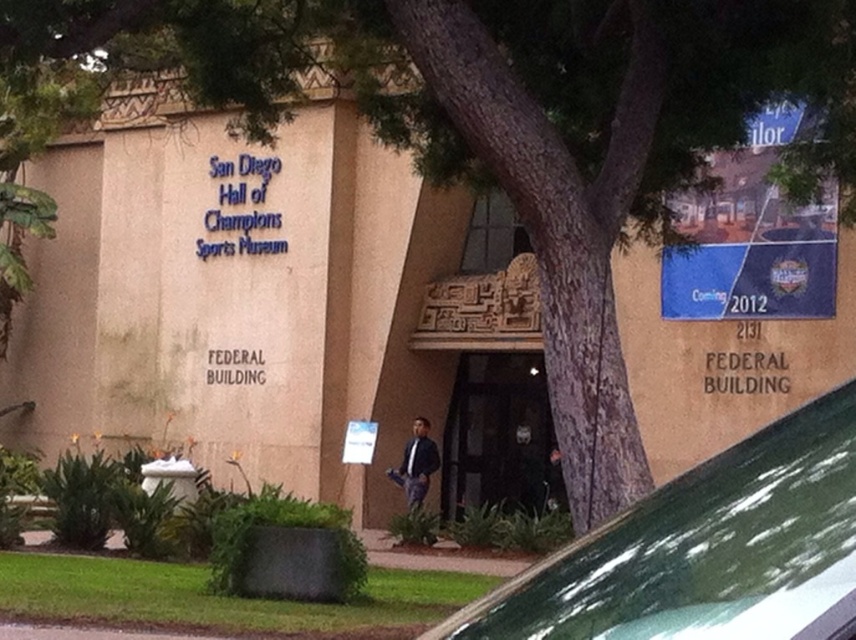
From the picture: Which is more to the right, green matte car at center or black glass door at center?

black glass door at center is more to the right.

This screenshot has width=856, height=640. In order to click on green matte car at center in this screenshot , I will do `click(706, 550)`.

Between point (823, 618) and point (491, 412), which one is positioned in front?

Point (823, 618)

You are a GUI agent. You are given a task and a screenshot of the screen. Output one action in this format:
    pyautogui.click(x=<x>, y=<y>)
    Task: Click on the green matte car at center
    Image resolution: width=856 pixels, height=640 pixels.
    Given the screenshot: What is the action you would take?
    pyautogui.click(x=706, y=550)

Is black glass door at center below dark blue jacket at center?

No.

This screenshot has width=856, height=640. What do you see at coordinates (498, 436) in the screenshot?
I see `black glass door at center` at bounding box center [498, 436].

Who is more distant from viewer, (502, 444) or (414, 484)?

The point (502, 444) is behind.

Where is `black glass door at center`? black glass door at center is located at coordinates (498, 436).

Who is positioned more to the left, green matte car at center or dark blue jacket at center?

dark blue jacket at center is more to the left.

Can you confirm if green matte car at center is thinner than dark blue jacket at center?

No.

Locate an element on the screen. The width and height of the screenshot is (856, 640). green matte car at center is located at coordinates (706, 550).